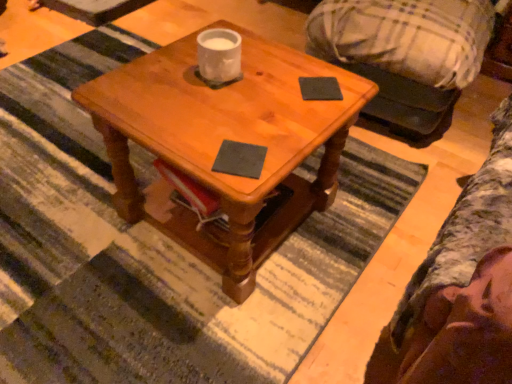
The image size is (512, 384). Find the location of `free space to the left of black matte notepad at upper right, positioned as the first notepad in top-to-bottom order`. free space to the left of black matte notepad at upper right, positioned as the first notepad in top-to-bottom order is located at coordinates (262, 87).